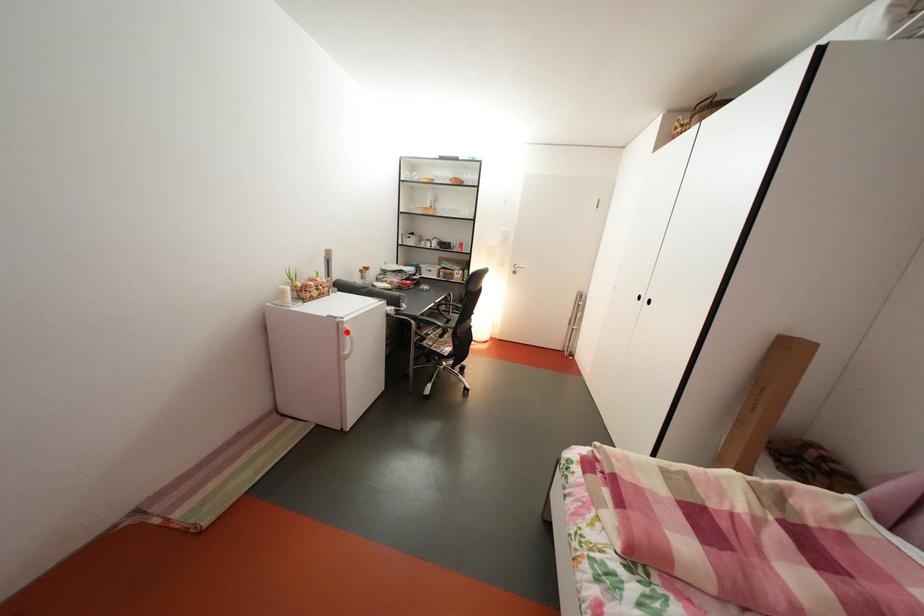
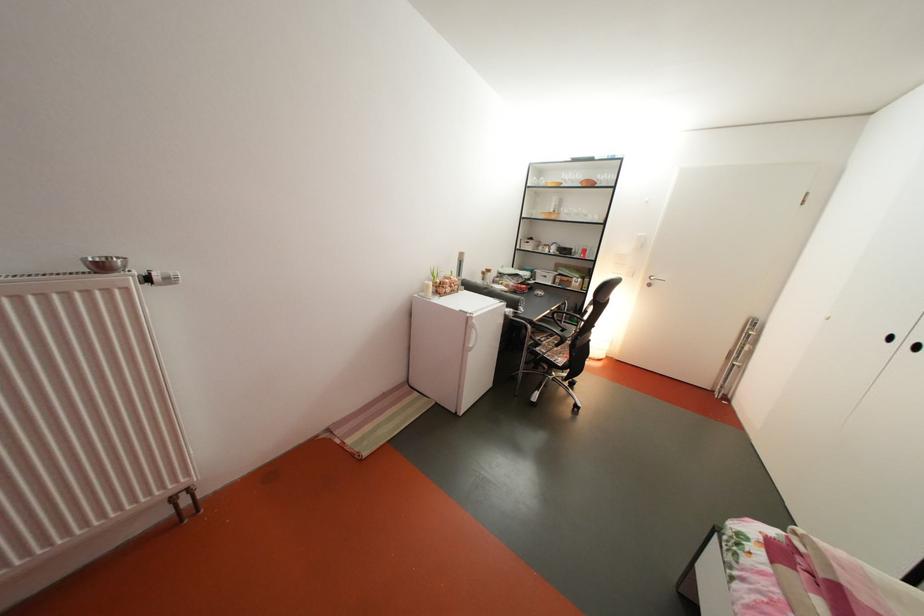
Question: I am providing you with two images of the same scene from different viewpoints. Given a red point in image1, look at the same physical point in image2. Is it:

Choices:
 (A) Closer to the viewpoint
 (B) Farther from the viewpoint

Answer: (B)